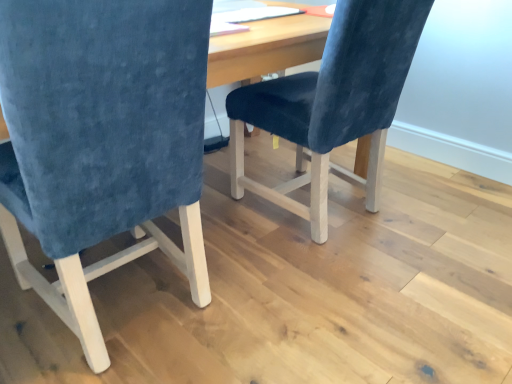
In order to face velvet blue chair at left, which appears as the 2th chair when viewed from the right, should I rotate leftwards or rightwards?

You should rotate left by 19.232 degrees.

Where is `velvet blue chair at left, which appears as the 2th chair when viewed from the right`? Image resolution: width=512 pixels, height=384 pixels. velvet blue chair at left, which appears as the 2th chair when viewed from the right is located at coordinates (101, 140).

How much space does velvet blue chair at left, which appears as the 2th chair when viewed from the right, occupy horizontally?

velvet blue chair at left, which appears as the 2th chair when viewed from the right, is 26.63 inches wide.

Image resolution: width=512 pixels, height=384 pixels. What do you see at coordinates (101, 140) in the screenshot?
I see `velvet blue chair at left, which appears as the 2th chair when viewed from the right` at bounding box center [101, 140].

Image resolution: width=512 pixels, height=384 pixels. Identify the location of velvet blue chair at center, which is the 2th chair from left to right. (333, 100).

Image resolution: width=512 pixels, height=384 pixels. What do you see at coordinates (333, 100) in the screenshot? I see `velvet blue chair at center, which ranks as the first chair in right-to-left order` at bounding box center [333, 100].

Where is `velvet blue chair at left, which appears as the 2th chair when viewed from the right`? This screenshot has height=384, width=512. velvet blue chair at left, which appears as the 2th chair when viewed from the right is located at coordinates (101, 140).

Considering the positions of objects velvet blue chair at left, which appears as the 2th chair when viewed from the right, and velvet blue chair at center, which ranks as the first chair in right-to-left order, in the image provided, who is more to the left, velvet blue chair at left, which appears as the 2th chair when viewed from the right, or velvet blue chair at center, which ranks as the first chair in right-to-left order,?

velvet blue chair at left, which appears as the 2th chair when viewed from the right.

Based on the photo, considering the relative positions of velvet blue chair at left, which appears as the 2th chair when viewed from the right, and velvet blue chair at center, which ranks as the first chair in right-to-left order, in the image provided, is velvet blue chair at left, which appears as the 2th chair when viewed from the right, behind velvet blue chair at center, which ranks as the first chair in right-to-left order,?

No, velvet blue chair at left, which appears as the 2th chair when viewed from the right, is closer to the viewer.

Which is closer, (178, 90) or (374, 106)?

Point (178, 90) is positioned closer to the camera compared to point (374, 106).

Based on the photo, from the image's perspective, is velvet blue chair at left, which appears as the 2th chair when viewed from the right, above or below velvet blue chair at center, which is the 2th chair from left to right?

velvet blue chair at left, which appears as the 2th chair when viewed from the right, is situated lower than velvet blue chair at center, which is the 2th chair from left to right, in the image.

From a real-world perspective, which object stands above the other?

From a 3D spatial view, velvet blue chair at left, which is the 1th chair in left-to-right order, is above.

Considering the sizes of objects velvet blue chair at left, which appears as the 2th chair when viewed from the right, and velvet blue chair at center, which is the 2th chair from left to right, in the image provided, who is wider, velvet blue chair at left, which appears as the 2th chair when viewed from the right, or velvet blue chair at center, which is the 2th chair from left to right,?

velvet blue chair at center, which is the 2th chair from left to right.

From their relative heights in the image, would you say velvet blue chair at left, which is the 1th chair in left-to-right order, is taller or shorter than velvet blue chair at center, which is the 2th chair from left to right?

In the image, velvet blue chair at left, which is the 1th chair in left-to-right order, appears to be taller than velvet blue chair at center, which is the 2th chair from left to right.

Considering the sizes of objects velvet blue chair at left, which appears as the 2th chair when viewed from the right, and velvet blue chair at center, which is the 2th chair from left to right, in the image provided, who is bigger, velvet blue chair at left, which appears as the 2th chair when viewed from the right, or velvet blue chair at center, which is the 2th chair from left to right,?

velvet blue chair at left, which appears as the 2th chair when viewed from the right.

Is velvet blue chair at left, which is the 1th chair in left-to-right order, outside of velvet blue chair at center, which ranks as the first chair in right-to-left order?

velvet blue chair at left, which is the 1th chair in left-to-right order, lies outside velvet blue chair at center, which ranks as the first chair in right-to-left order,'s area.

Are velvet blue chair at left, which is the 1th chair in left-to-right order, and velvet blue chair at center, which is the 2th chair from left to right, far apart?

Actually, velvet blue chair at left, which is the 1th chair in left-to-right order, and velvet blue chair at center, which is the 2th chair from left to right, are a little close together.

Is velvet blue chair at left, which is the 1th chair in left-to-right order, oriented towards velvet blue chair at center, which is the 2th chair from left to right?

No, velvet blue chair at left, which is the 1th chair in left-to-right order, is not turned towards velvet blue chair at center, which is the 2th chair from left to right.

How many degrees apart are the facing directions of velvet blue chair at left, which is the 1th chair in left-to-right order, and velvet blue chair at center, which is the 2th chair from left to right?

2.47 degrees separate the facing orientations of velvet blue chair at left, which is the 1th chair in left-to-right order, and velvet blue chair at center, which is the 2th chair from left to right.

Find the location of a particular element. The width and height of the screenshot is (512, 384). chair in front of the velvet blue chair at center, which is the 2th chair from left to right is located at coordinates (101, 140).

Is velvet blue chair at center, which ranks as the first chair in right-to-left order, to the left or to the right of velvet blue chair at left, which appears as the 2th chair when viewed from the right, in the image?

Based on their positions, velvet blue chair at center, which ranks as the first chair in right-to-left order, is located to the right of velvet blue chair at left, which appears as the 2th chair when viewed from the right.

Relative to velvet blue chair at left, which is the 1th chair in left-to-right order, is velvet blue chair at center, which is the 2th chair from left to right, in front or behind?

Visually, velvet blue chair at center, which is the 2th chair from left to right, is located behind velvet blue chair at left, which is the 1th chair in left-to-right order.

Which point is more forward, (251, 85) or (193, 45)?

Positioned in front is point (193, 45).

From the image's perspective, which is below, velvet blue chair at center, which ranks as the first chair in right-to-left order, or velvet blue chair at left, which is the 1th chair in left-to-right order?

velvet blue chair at left, which is the 1th chair in left-to-right order.

Consider the image. From a real-world perspective, is velvet blue chair at center, which is the 2th chair from left to right, physically located above or below velvet blue chair at left, which appears as the 2th chair when viewed from the right?

velvet blue chair at center, which is the 2th chair from left to right, is situated lower than velvet blue chair at left, which appears as the 2th chair when viewed from the right, in the real world.

Which of these two, velvet blue chair at center, which is the 2th chair from left to right, or velvet blue chair at left, which appears as the 2th chair when viewed from the right, is thinner?

velvet blue chair at left, which appears as the 2th chair when viewed from the right.

From their relative heights in the image, would you say velvet blue chair at center, which is the 2th chair from left to right, is taller or shorter than velvet blue chair at left, which is the 1th chair in left-to-right order?

Considering their sizes, velvet blue chair at center, which is the 2th chair from left to right, has less height than velvet blue chair at left, which is the 1th chair in left-to-right order.

Looking at this image, which of these two, velvet blue chair at center, which ranks as the first chair in right-to-left order, or velvet blue chair at left, which appears as the 2th chair when viewed from the right, is smaller?

Smaller between the two is velvet blue chair at center, which ranks as the first chair in right-to-left order.

Is velvet blue chair at center, which is the 2th chair from left to right, not within velvet blue chair at left, which is the 1th chair in left-to-right order?

Yes, velvet blue chair at center, which is the 2th chair from left to right, is not within velvet blue chair at left, which is the 1th chair in left-to-right order.

Is the surface of velvet blue chair at center, which is the 2th chair from left to right, in direct contact with velvet blue chair at left, which appears as the 2th chair when viewed from the right?

There is a gap between velvet blue chair at center, which is the 2th chair from left to right, and velvet blue chair at left, which appears as the 2th chair when viewed from the right.

Does velvet blue chair at center, which is the 2th chair from left to right, turn towards velvet blue chair at left, which is the 1th chair in left-to-right order?

No, velvet blue chair at center, which is the 2th chair from left to right, is not oriented towards velvet blue chair at left, which is the 1th chair in left-to-right order.

Could you measure the distance between velvet blue chair at center, which ranks as the first chair in right-to-left order, and velvet blue chair at left, which is the 1th chair in left-to-right order?

velvet blue chair at center, which ranks as the first chair in right-to-left order, is 25.96 inches away from velvet blue chair at left, which is the 1th chair in left-to-right order.

The width and height of the screenshot is (512, 384). There is a velvet blue chair at center, which ranks as the first chair in right-to-left order. Identify the location of chair above it (from a real-world perspective). (101, 140).

Where is `chair behind the velvet blue chair at left, which appears as the 2th chair when viewed from the right`? This screenshot has height=384, width=512. chair behind the velvet blue chair at left, which appears as the 2th chair when viewed from the right is located at coordinates click(x=333, y=100).

At what (x,y) coordinates should I click in order to perform the action: click on chair below the velvet blue chair at center, which ranks as the first chair in right-to-left order (from the image's perspective). Please return your answer as a coordinate pair (x, y). This screenshot has width=512, height=384. Looking at the image, I should click on (101, 140).